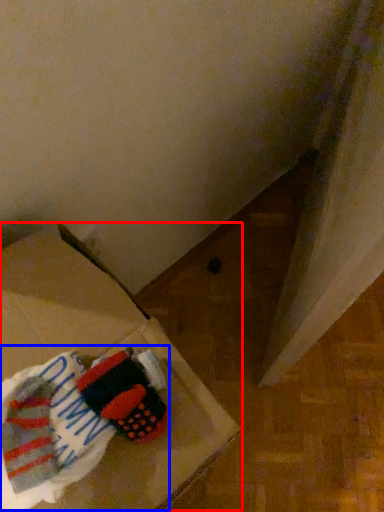
Question: Which object is further to the camera taking this photo, cardboard box (highlighted by a red box) or laundry (highlighted by a blue box)?

Choices:
 (A) cardboard box
 (B) laundry

Answer: (B)